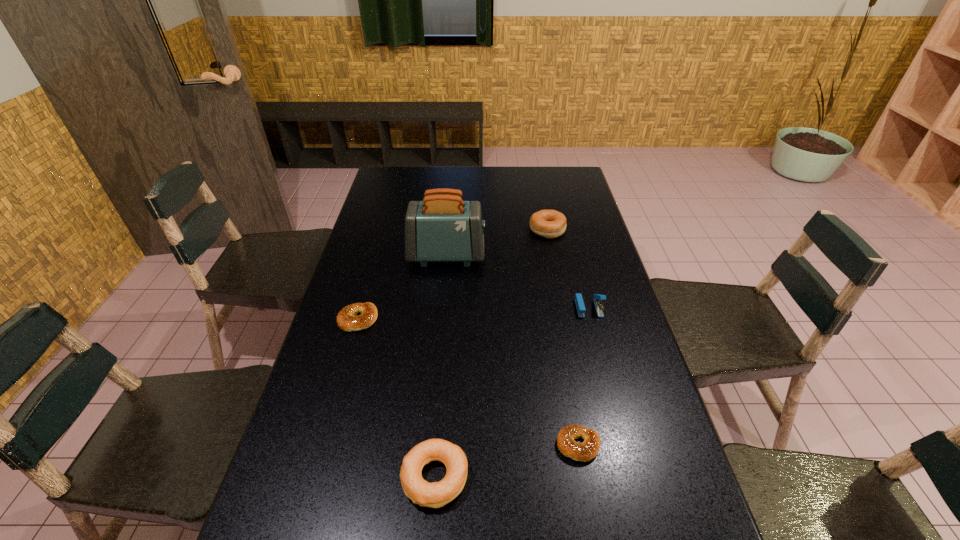
Locate an element on the screen. vacant area between the third shortest bagel and the stapler is located at coordinates (512, 393).

This screenshot has width=960, height=540. In order to click on unoccupied position between the second shortest object and the third bagel from right to left in this screenshot , I will do `click(396, 398)`.

The image size is (960, 540). I want to click on the third closest object to the second bagel from left to right, so click(x=579, y=302).

Find the location of a particular element. object that is the fourth nearest to the stapler is located at coordinates (437, 494).

Where is `the third closest bagel to the stapler`? This screenshot has height=540, width=960. the third closest bagel to the stapler is located at coordinates (437, 494).

Point out which bagel is positioned as the third nearest to the stapler. Please provide its 2D coordinates. Your answer should be formatted as a tuple, i.e. [(x, y)], where the tuple contains the x and y coordinates of a point satisfying the conditions above.

[(437, 494)]

Where is `free space that satisfies the following two spatial constraints: 1. on the front-facing side of the second farthest object; 2. on the front side of the second shortest object`? free space that satisfies the following two spatial constraints: 1. on the front-facing side of the second farthest object; 2. on the front side of the second shortest object is located at coordinates (441, 319).

The height and width of the screenshot is (540, 960). Find the location of `free spot that satisfies the following two spatial constraints: 1. on the front-facing side of the second farthest object; 2. on the left side of the stapler`. free spot that satisfies the following two spatial constraints: 1. on the front-facing side of the second farthest object; 2. on the left side of the stapler is located at coordinates (442, 308).